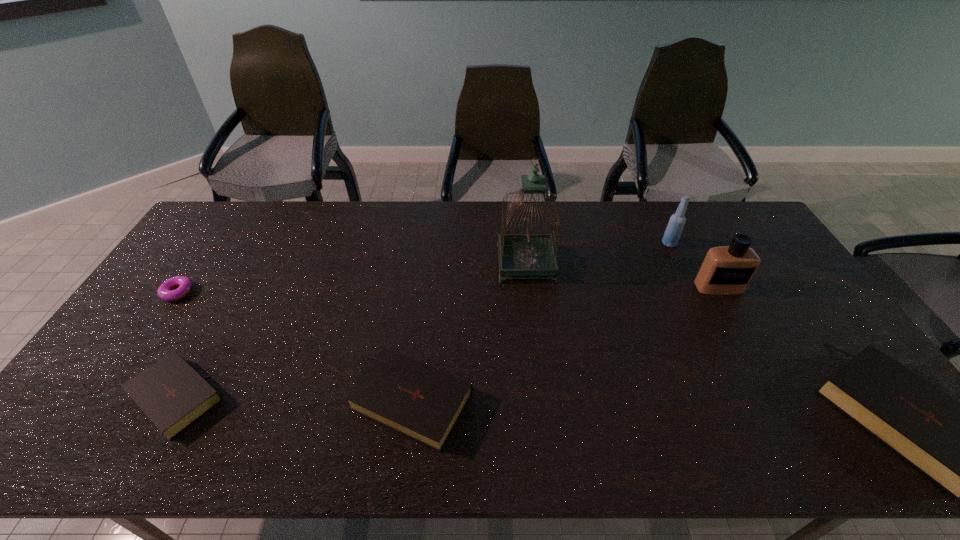
Please point a location where one more Bible can be added evenly. Please provide its 2D coordinates. Your answer should be formatted as a tuple, i.e. [(x, y)], where the tuple contains the x and y coordinates of a point satisfying the conditions above.

[(651, 406)]